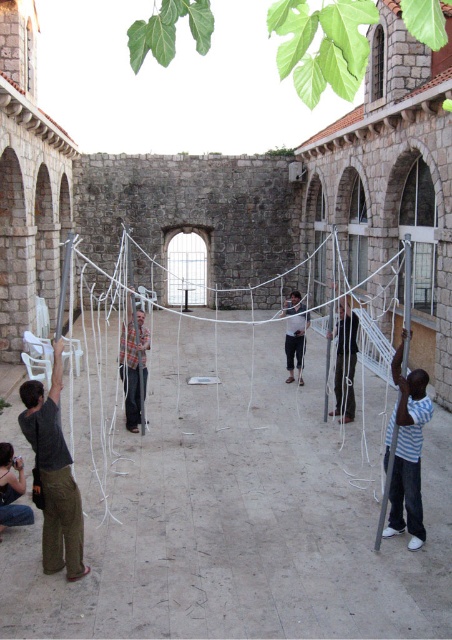
Consider the image. Is white string net at center to the right of matte white shirt at center from the viewer's perspective?

In fact, white string net at center is to the left of matte white shirt at center.

Is point (265, 314) more distant than point (286, 346)?

Yes, it is behind point (286, 346).

You are a GUI agent. You are given a task and a screenshot of the screen. Output one action in this format:
    pyautogui.click(x=<x>, y=<y>)
    Task: Click on the white string net at center
    
    Given the screenshot: What is the action you would take?
    pyautogui.click(x=225, y=390)

Does plaid shirt at center appear on the left side of denim jeans at lower left?

No, plaid shirt at center is not to the left of denim jeans at lower left.

Looking at this image, does plaid shirt at center appear under denim jeans at lower left?

No.

Where is `plaid shirt at center`? The width and height of the screenshot is (452, 640). plaid shirt at center is located at coordinates (133, 365).

Can you confirm if dark gray fabric at center is taller than denim jeans at lower left?

Yes, dark gray fabric at center is taller than denim jeans at lower left.

Between point (343, 355) and point (22, 524), which one is positioned in front?

Positioned in front is point (22, 524).

The width and height of the screenshot is (452, 640). Find the location of `dark gray fabric at center`. dark gray fabric at center is located at coordinates click(x=344, y=360).